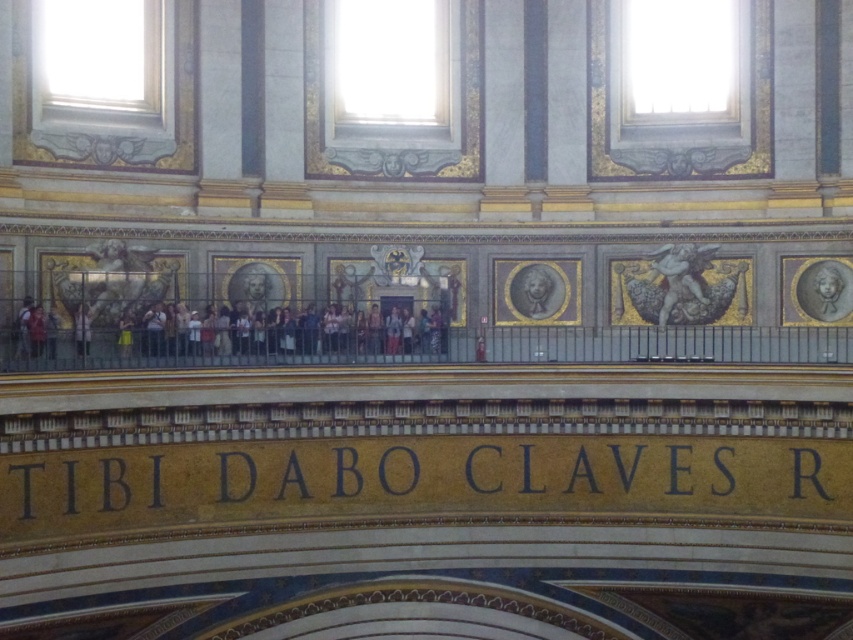
Question: Is polished bronze cherub at upper right in front of gray stone bust at center?

Choices:
 (A) yes
 (B) no

Answer: (A)

Question: Which object appears farthest from the camera in this image?

Choices:
 (A) polished bronze cherub at upper right
 (B) smooth gray stone portrait at upper right
 (C) light brown leather jacket at left

Answer: (A)

Question: Can you confirm if smooth gray stone portrait at upper right is thinner than light brown leather jacket at left?

Choices:
 (A) no
 (B) yes

Answer: (A)

Question: Which point is closer to the camera taking this photo?

Choices:
 (A) (558, 284)
 (B) (85, 349)
 (C) (686, 284)

Answer: (B)

Question: Which object is farther from the camera taking this photo?

Choices:
 (A) light brown leather jacket at left
 (B) polished bronze cherub at upper right

Answer: (B)

Question: Where is smooth gray stone portrait at upper right located in relation to polished bronze cherub at upper right in the image?

Choices:
 (A) above
 (B) below

Answer: (B)